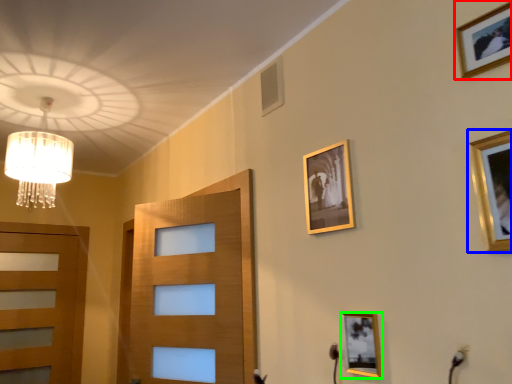
Question: Considering the real-world distances, which object is farthest from picture frame (highlighted by a red box)? picture frame (highlighted by a blue box) or picture frame (highlighted by a green box)?

Choices:
 (A) picture frame
 (B) picture frame

Answer: (B)